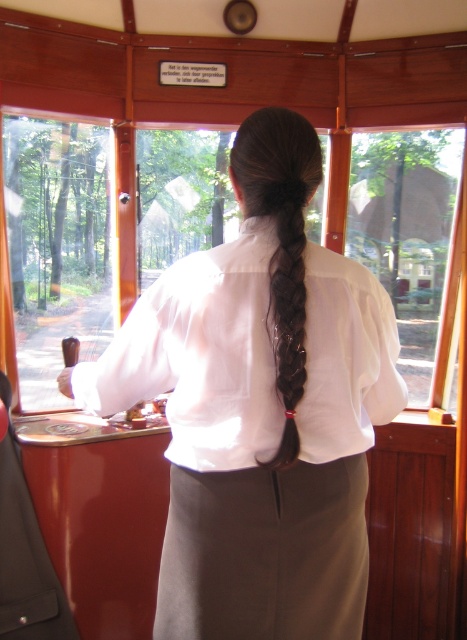
Question: Does smooth brown hair at center have a smaller size compared to transparent glass window at left?

Choices:
 (A) yes
 (B) no

Answer: (B)

Question: Can you confirm if white smooth shirt at center is positioned below transparent glass window at left?

Choices:
 (A) no
 (B) yes

Answer: (B)

Question: Estimate the real-world distances between objects in this image. Which object is farther from the white smooth shirt at center?

Choices:
 (A) transparent glass window at center
 (B) transparent glass window at left

Answer: (A)

Question: Does smooth brown hair at center have a larger size compared to brown silky hair at center back?

Choices:
 (A) no
 (B) yes

Answer: (B)

Question: Which object appears closest to the camera in this image?

Choices:
 (A) brown silky hair braid at center back
 (B) transparent glass window at center
 (C) white smooth shirt at center
 (D) smooth brown hair at center

Answer: (A)

Question: Which point is closer to the camera taking this photo?

Choices:
 (A) (303, 372)
 (B) (80, 224)

Answer: (A)